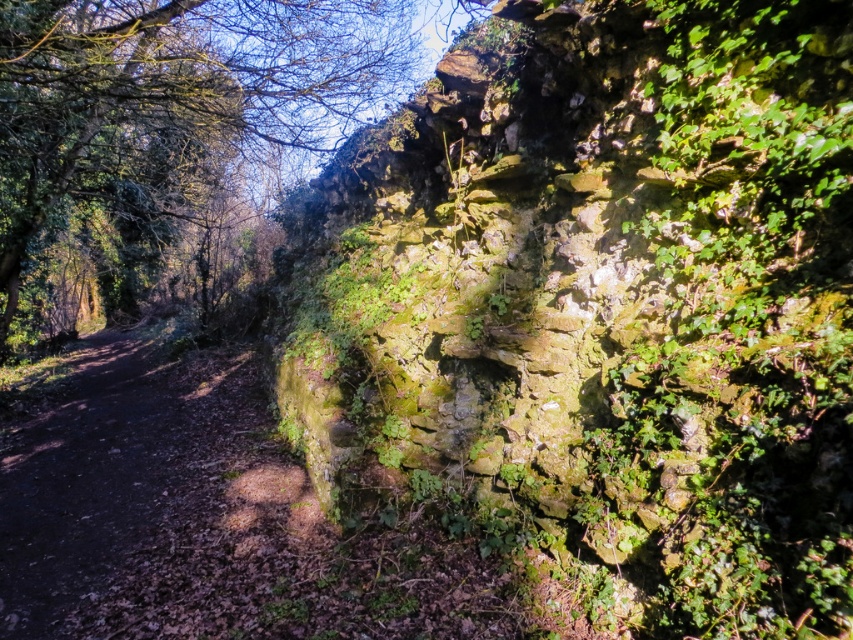
Based on the photo, can you confirm if green mossy stone wall at upper right is positioned to the left of green mossy wall at upper center?

In fact, green mossy stone wall at upper right is to the right of green mossy wall at upper center.

Who is more distant from viewer, [437,458] or [167,168]?

Positioned behind is point [167,168].

The image size is (853, 640). Describe the element at coordinates (602, 301) in the screenshot. I see `green mossy stone wall at upper right` at that location.

At what (x,y) coordinates should I click in order to perform the action: click on green mossy stone wall at upper right. Please return your answer as a coordinate pair (x, y). The image size is (853, 640). Looking at the image, I should click on (602, 301).